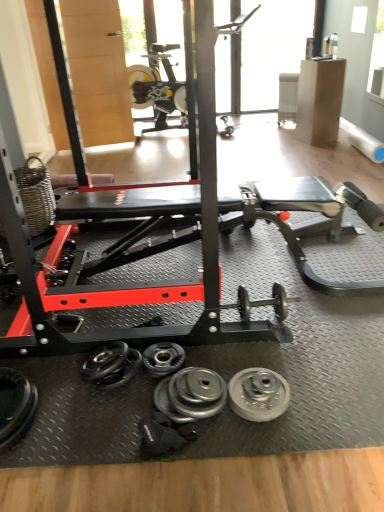
Locate an element on the screen. Image resolution: width=384 pixels, height=512 pixels. vacant area on the back side of silver metallic dumbbell at center, acting as the third dumbbell starting from the left is located at coordinates (211, 357).